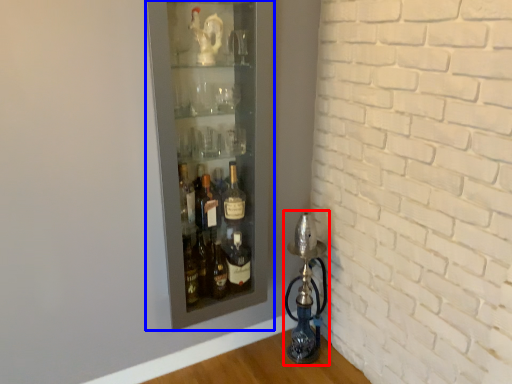
Question: Which of the following is the closest to the observer, oil lamp (highlighted by a red box) or shelf (highlighted by a blue box)?

Choices:
 (A) oil lamp
 (B) shelf

Answer: (B)